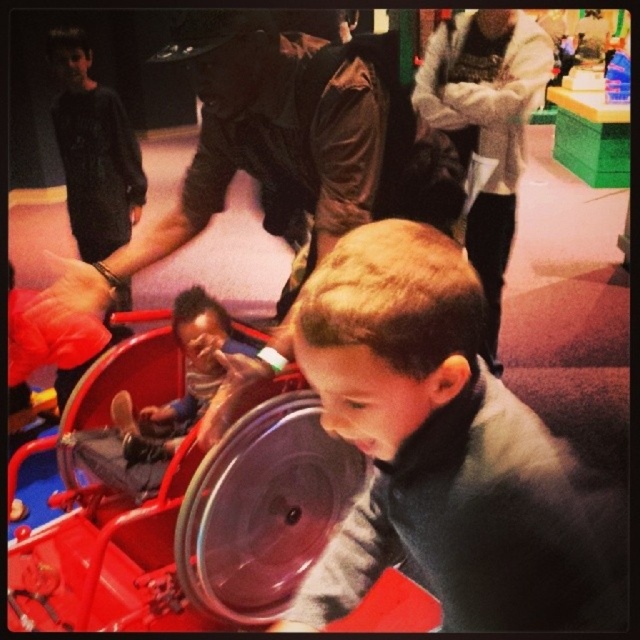
You are standing in the play area and see the point at coordinates (484, 124). Which object does this point belong to?

The point at coordinates (484, 124) belongs to the white fleece jacket at upper center.

You are a parent trying to retrieve the smooth plastic toy at center from under the smooth gray sweater at center. Based on the scene description, can you easily access the toy without moving the sweater?

The smooth gray sweater at center is positioned over smooth plastic toy at center, so you would need to move the sweater to access the toy.